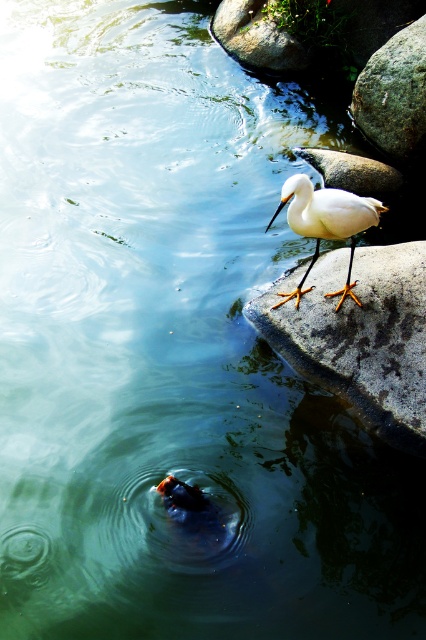
You are standing at a point 5.21 meters away from the point marked at coordinates point (405, 317). Can you see the white egret on the rock in the foreground from your current position?

Yes, you can see the white egret on the rock in the foreground from your current position because the point marked at coordinates point (405, 317) is 5.21 meters away from you, and the scene is described as serene with calm water and a visible egret on the rock.

You are an ornithologist observing the scene. You need to determine which object is larger between the smooth gray rock at upper right and the white matte bird at upper right. Based on the scene, which one is larger?

The smooth gray rock at upper right is bigger than the white matte bird at upper right, so the rock is larger.

You are a photographer aiming to capture the white matte bird at upper right and the white matte stone at right in a single shot. Based on their positions, can you determine which object is closer to the camera?

The white matte stone at right is located below the white matte bird at upper right, so the bird is closer to the camera.